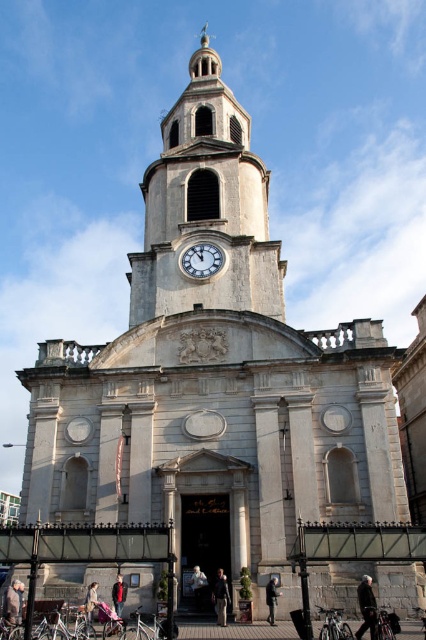
From the picture: Between white stone clock tower at center and dark gray suit at center, which one is positioned lower?

dark gray suit at center is below.

Does white stone clock tower at center appear over dark gray suit at center?

Yes, white stone clock tower at center is above dark gray suit at center.

The height and width of the screenshot is (640, 426). I want to click on white stone clock tower at center, so click(206, 208).

Which is in front, point (193, 584) or point (86, 620)?

Point (86, 620) is in front.

Who is lower down, light gray fabric jacket at center or denim jacket at lower left?

light gray fabric jacket at center is below.

Does point (198, 572) come farther from viewer compared to point (92, 611)?

Yes, it is behind point (92, 611).

Locate an element on the screen. light gray fabric jacket at center is located at coordinates (198, 586).

Is light brown leather jacket at lower left closer to the viewer compared to dark gray suit at center?

Yes, light brown leather jacket at lower left is closer to the viewer.

Describe the element at coordinates (13, 605) in the screenshot. This screenshot has width=426, height=640. I see `light brown leather jacket at lower left` at that location.

Identify the location of light brown leather jacket at lower left. The image size is (426, 640). (13, 605).

This screenshot has width=426, height=640. Find the location of `light brown leather jacket at lower left`. light brown leather jacket at lower left is located at coordinates coord(13,605).